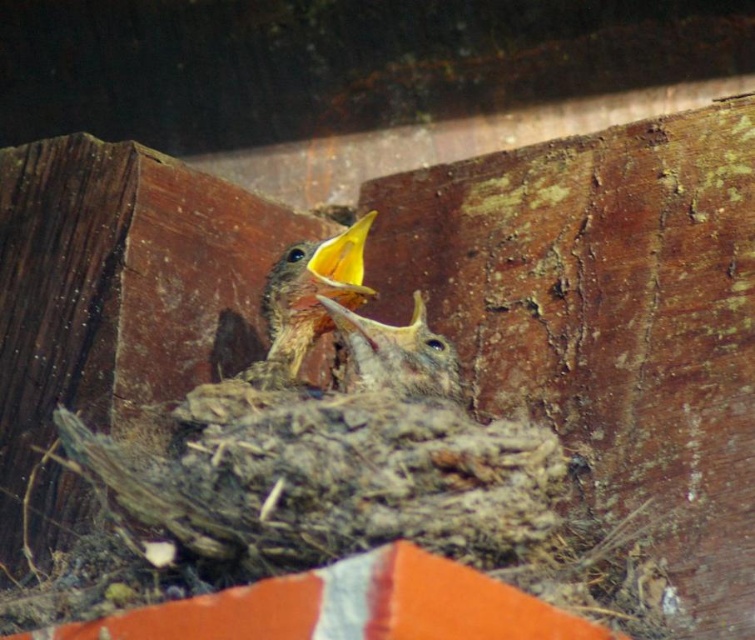
Who is taller, brown speckled feathers at center or yellow matte beak at center?

With more height is brown speckled feathers at center.

The image size is (755, 640). Describe the element at coordinates (307, 300) in the screenshot. I see `brown speckled feathers at center` at that location.

Locate an element on the screen. The image size is (755, 640). brown speckled feathers at center is located at coordinates (307, 300).

Can you confirm if smooth brown bird at center is taller than yellow matte beak at center?

Yes, smooth brown bird at center is taller than yellow matte beak at center.

Is smooth brown bird at center further to the viewer compared to yellow matte beak at center?

No.

At what (x,y) coordinates should I click in order to perform the action: click on smooth brown bird at center. Please return your answer as a coordinate pair (x, y). Looking at the image, I should click on (398, 355).

Find the location of a particular element. Image resolution: width=755 pixels, height=640 pixels. smooth brown bird at center is located at coordinates (398, 355).

Is brown speckled feathers at center bigger than smooth brown bird at center?

Correct, brown speckled feathers at center is larger in size than smooth brown bird at center.

Which is behind, point (313, 314) or point (384, 324)?

The point (313, 314) is behind.

This screenshot has height=640, width=755. In order to click on brown speckled feathers at center in this screenshot , I will do `click(307, 300)`.